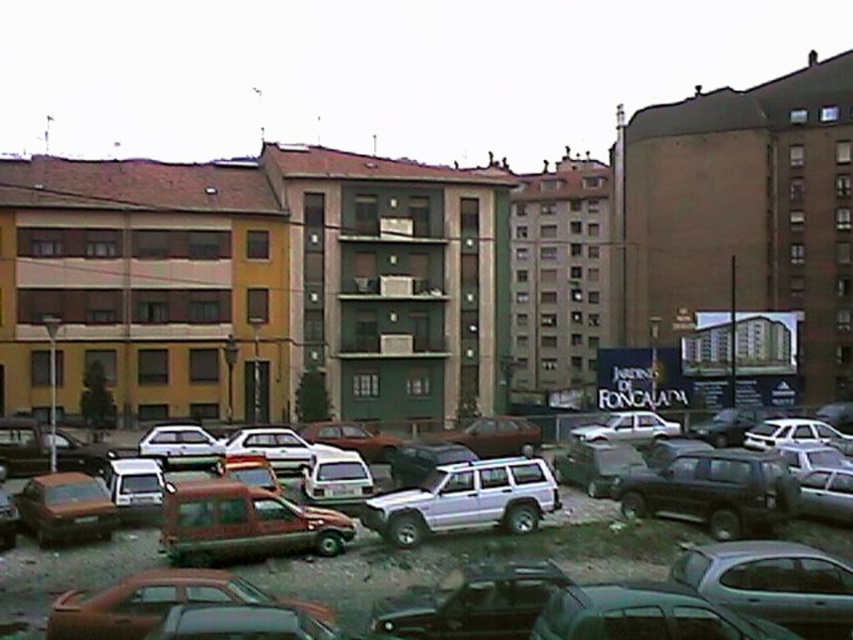
Who is positioned more to the right, metallic red van at center or silver metallic sedan at center?

silver metallic sedan at center is more to the right.

Can you confirm if metallic red van at center is bigger than silver metallic sedan at center?

Actually, metallic red van at center might be smaller than silver metallic sedan at center.

At what (x,y) coordinates should I click in order to perform the action: click on metallic red van at center. Please return your answer as a coordinate pair (x, y). This screenshot has height=640, width=853. Looking at the image, I should click on (242, 524).

Is shiny black suv at center right thinner than satin silver suv at center?

Correct, shiny black suv at center right's width is less than satin silver suv at center's.

Does point (740, 458) come in front of point (502, 481)?

No, it is not.

Between point (679, 458) and point (512, 524), which one is positioned behind?

Point (679, 458)

Identify the location of shiny black suv at center right. The height and width of the screenshot is (640, 853). (714, 492).

Who is positioned more to the right, metallic red van at center or satin silver suv at center?

From the viewer's perspective, satin silver suv at center appears more on the right side.

Is metallic red van at center below satin silver suv at center?

Yes.

Is point (204, 513) behind point (500, 504)?

No, it is in front of (500, 504).

Where is `metallic red van at center`? The image size is (853, 640). metallic red van at center is located at coordinates (242, 524).